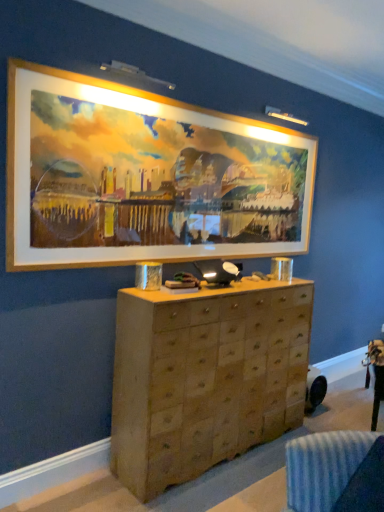
Where is `blank space above wooden frame at upper center (from a real-world perspective)`? The width and height of the screenshot is (384, 512). blank space above wooden frame at upper center (from a real-world perspective) is located at coordinates (207, 108).